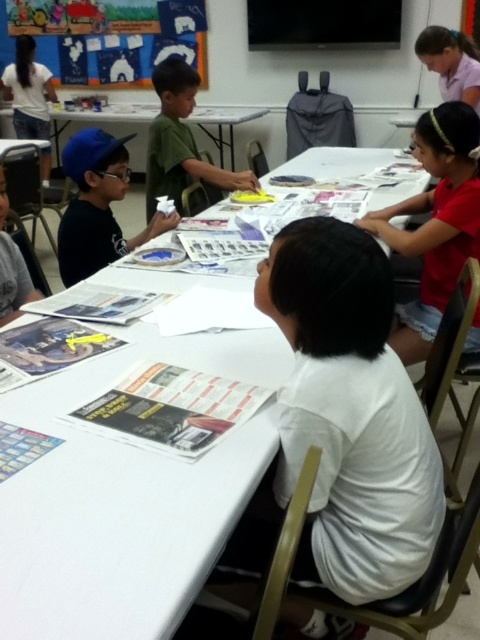
You are a student sitting at the white table in the classroom. You notice two points marked on the table. One is at coordinate point(243,458) and the other is at point(178,120). Which point is closer to you?

Point(243,458) is closer to the viewer than point(178,120).

You are a teacher in the classroom looking at the white matte shirt at upper right and the matte blue cap at left. Which object is positioned more to the right side of the table?

The white matte shirt at upper right is positioned more to the right side of the table than the matte blue cap at left.

You are a teacher in the classroom and want to hand out new art supplies to the children. You have two items to distribute first. The white matte shirt at upper right is wearing a name tag, and the matte blue cap at left is worn by another child. Since you are standing at the front of the classroom, which child should you approach first to ensure you reach them without walking around the table?

The white matte shirt at upper right is located below the matte blue cap at left, so you should approach the matte blue cap at left first because it is closer to you at the front of the classroom.